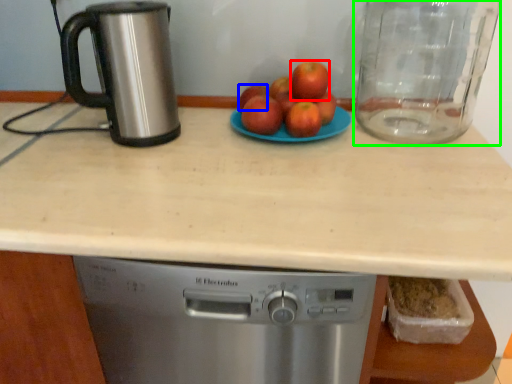
Question: Which is farther away from apple (highlighted by a red box)? apple (highlighted by a blue box) or glass jar (highlighted by a green box)?

Choices:
 (A) apple
 (B) glass jar

Answer: (B)